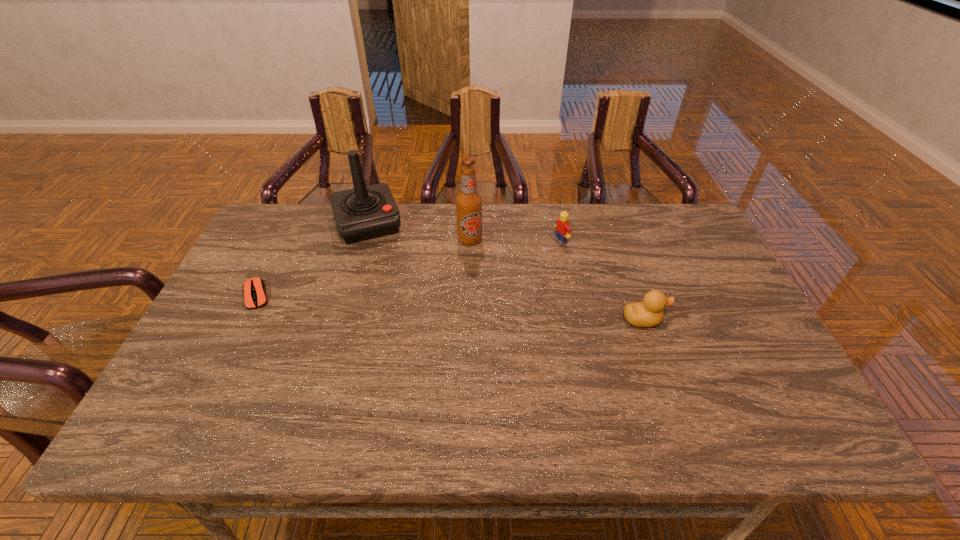
The width and height of the screenshot is (960, 540). Find the location of `vacant spot on the desktop that is between the leftmost object and the rightmost object and is positioned on the front label of the third object from right to left`. vacant spot on the desktop that is between the leftmost object and the rightmost object and is positioned on the front label of the third object from right to left is located at coordinates (491, 310).

At what (x,y) coordinates should I click in order to perform the action: click on free space on the desktop that is between the shortest object and the duckling and is positioned on the front-facing side of the fourth object from left to right. Please return your answer as a coordinate pair (x, y). This screenshot has height=540, width=960. Looking at the image, I should click on (406, 305).

Where is `vacant space on the desktop that is between the shortest object and the rightmost object and is positioned on the front-facing side of the fourth object from right to left`? This screenshot has height=540, width=960. vacant space on the desktop that is between the shortest object and the rightmost object and is positioned on the front-facing side of the fourth object from right to left is located at coordinates (396, 304).